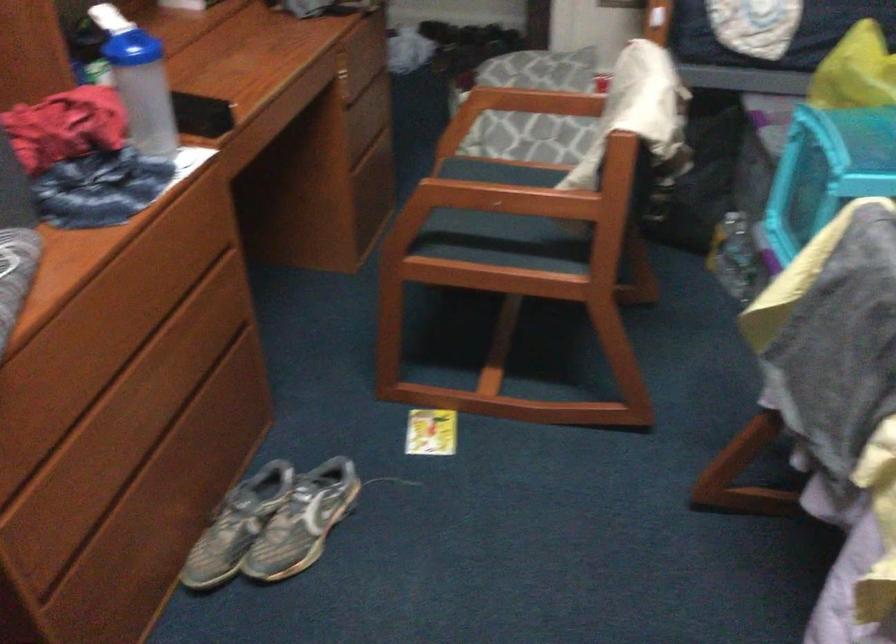
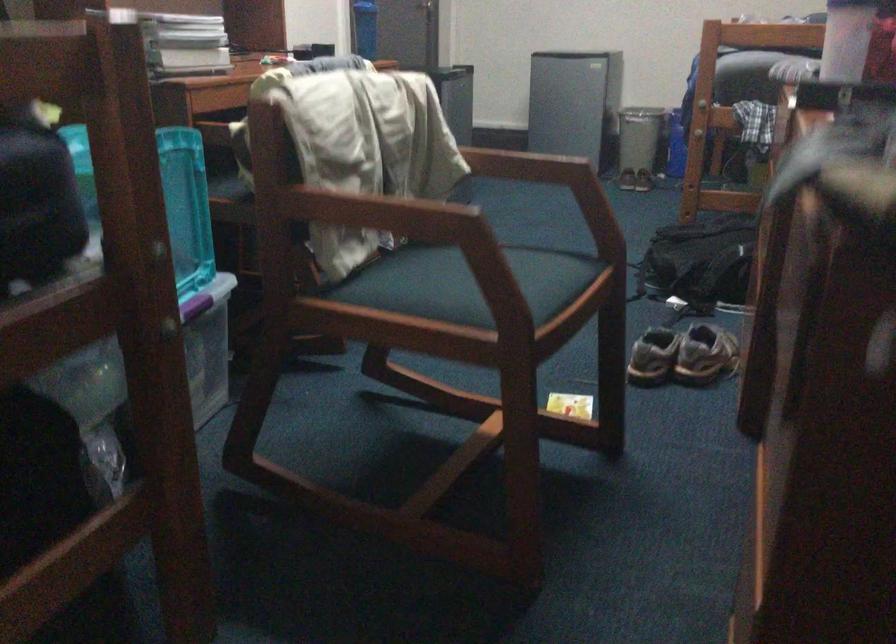
Locate, in the second image, the point that corresponds to point (298, 469) in the first image.

(682, 355)